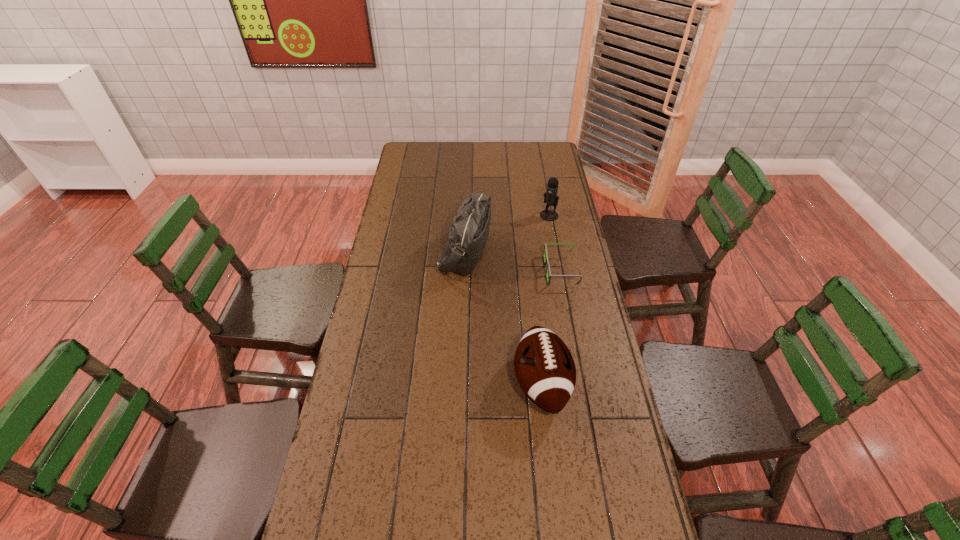
Identify the location of vacant space situated 0.070m on the lens of the spectacles. (526, 271).

This screenshot has height=540, width=960. Identify the location of microphone at the right edge. (550, 197).

Where is `football (American) located in the right edge section of the desktop`? Image resolution: width=960 pixels, height=540 pixels. football (American) located in the right edge section of the desktop is located at coordinates (544, 367).

Where is `spectacles present at the right edge`? Image resolution: width=960 pixels, height=540 pixels. spectacles present at the right edge is located at coordinates (546, 261).

I want to click on vacant space at the left edge, so click(x=382, y=312).

Identify the location of free spot at the right edge of the desktop. The image size is (960, 540). (569, 281).

The width and height of the screenshot is (960, 540). Find the location of `vacant space at the far right corner of the desktop`. vacant space at the far right corner of the desktop is located at coordinates (541, 144).

The image size is (960, 540). In order to click on free space between the leftmost object and the spectacles in this screenshot , I will do `click(513, 261)`.

Identify the location of empty space that is in between the shortest object and the farthest object. Image resolution: width=960 pixels, height=540 pixels. (555, 243).

Locate an element on the screen. The image size is (960, 540). free space between the spectacles and the microphone is located at coordinates (555, 243).